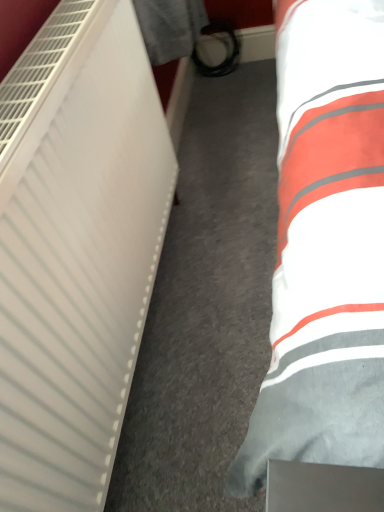
You are a GUI agent. You are given a task and a screenshot of the screen. Output one action in this format:
    pyautogui.click(x=<x>, y=<y>)
    Task: Click on the vacant space underneath white matte radiator at left (from a real-world perspective)
    The image size is (384, 512).
    Given the screenshot: What is the action you would take?
    click(x=152, y=333)